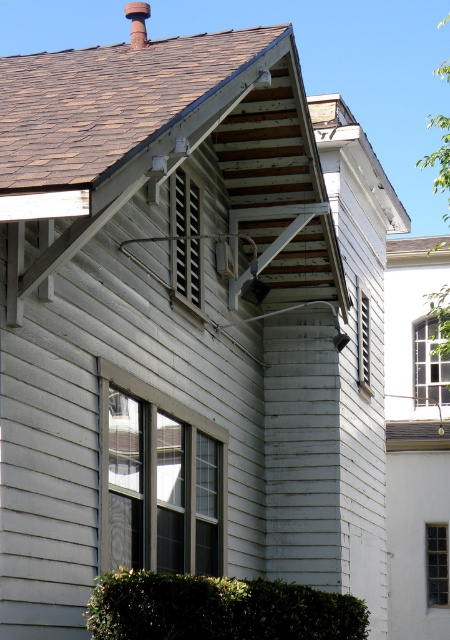
Which is in front, point (251, 612) or point (148, 6)?

Positioned in front is point (251, 612).

Can you confirm if green leafy hedge at lower center is wider than smooth brick chimney at upper center?

No, green leafy hedge at lower center is not wider than smooth brick chimney at upper center.

Between point (95, 634) and point (126, 3), which one is positioned in front?

Point (95, 634) is in front.

At what (x,y) coordinates should I click in order to perform the action: click on green leafy hedge at lower center. Please return your answer as a coordinate pair (x, y). The image size is (450, 640). Looking at the image, I should click on (217, 609).